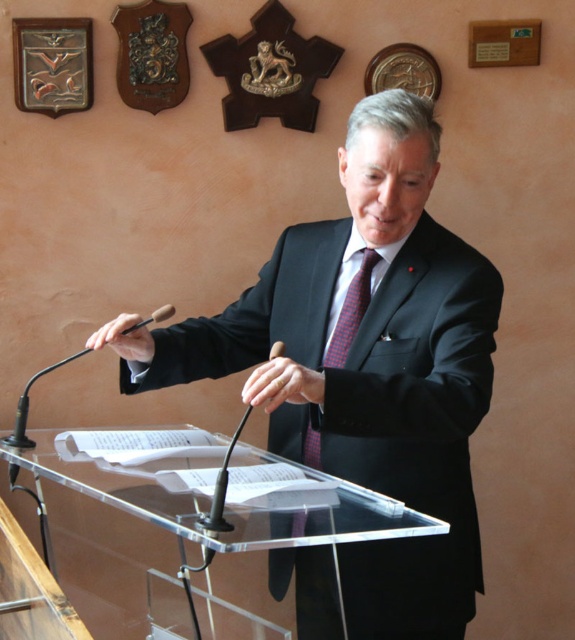
You are an event planner observing the scene and need to ensure the speaker is properly dressed for the formal event. Based on the image, does the black glossy suit at center appear above or below the red checkered tie at center?

The black glossy suit at center is positioned under the red checkered tie at center, so the suit appears below the tie.

You are an event planner organizing a conference. You need to ensure that the transparent acrylic podium at center and the red checkered tie at center are visible to all attendees. Given their sizes, which object should be placed closer to the audience to ensure visibility?

The transparent acrylic podium at center is larger in size than the red checkered tie at center, so the podium should be placed closer to the audience to ensure its visibility, while the tie can be positioned slightly further back as it is smaller and still visible.